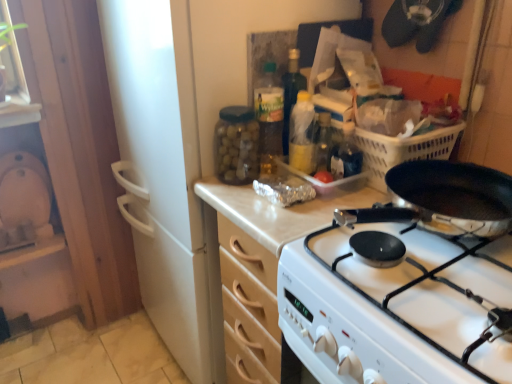
Question: Should I look upward or downward to see white glossy gas stove at center?

Choices:
 (A) down
 (B) up

Answer: (A)

Question: From the image's perspective, is white glossy gas stove at center on clear plastic container at center?

Choices:
 (A) no
 (B) yes

Answer: (A)

Question: Does white glossy gas stove at center touch clear plastic container at center?

Choices:
 (A) yes
 (B) no

Answer: (B)

Question: Is white glossy gas stove at center aimed at clear plastic container at center?

Choices:
 (A) no
 (B) yes

Answer: (A)

Question: Would you say white glossy gas stove at center is a long distance from clear plastic container at center?

Choices:
 (A) no
 (B) yes

Answer: (A)

Question: Is white glossy gas stove at center positioned behind clear plastic container at center?

Choices:
 (A) yes
 (B) no

Answer: (B)

Question: From a real-world perspective, is white glossy gas stove at center positioned over clear plastic container at center based on gravity?

Choices:
 (A) yes
 (B) no

Answer: (B)

Question: Is the position of transparent glass jar at upper center, which is the first bottle from left to right, more distant than that of wooden cabinet at center?

Choices:
 (A) yes
 (B) no

Answer: (A)

Question: Considering the relative sizes of transparent glass jar at upper center, which is the third bottle from right to left, and wooden cabinet at center in the image provided, is transparent glass jar at upper center, which is the third bottle from right to left, thinner than wooden cabinet at center?

Choices:
 (A) yes
 (B) no

Answer: (A)

Question: From a real-world perspective, does transparent glass jar at upper center, which is the first bottle from left to right, sit lower than wooden cabinet at center?

Choices:
 (A) no
 (B) yes

Answer: (A)

Question: Is transparent glass jar at upper center, which is the third bottle from right to left, in front of wooden cabinet at center?

Choices:
 (A) yes
 (B) no

Answer: (B)

Question: Is wooden cabinet at center completely or partially inside transparent glass jar at upper center, which is the third bottle from right to left?

Choices:
 (A) no
 (B) yes

Answer: (A)

Question: Is transparent glass jar at upper center, which is the first bottle from left to right, smaller than wooden cabinet at center?

Choices:
 (A) no
 (B) yes

Answer: (B)

Question: Can you confirm if white glossy gas stove at center is shorter than translucent plastic bottle at center, placed as the second bottle when sorted from left to right?

Choices:
 (A) no
 (B) yes

Answer: (B)